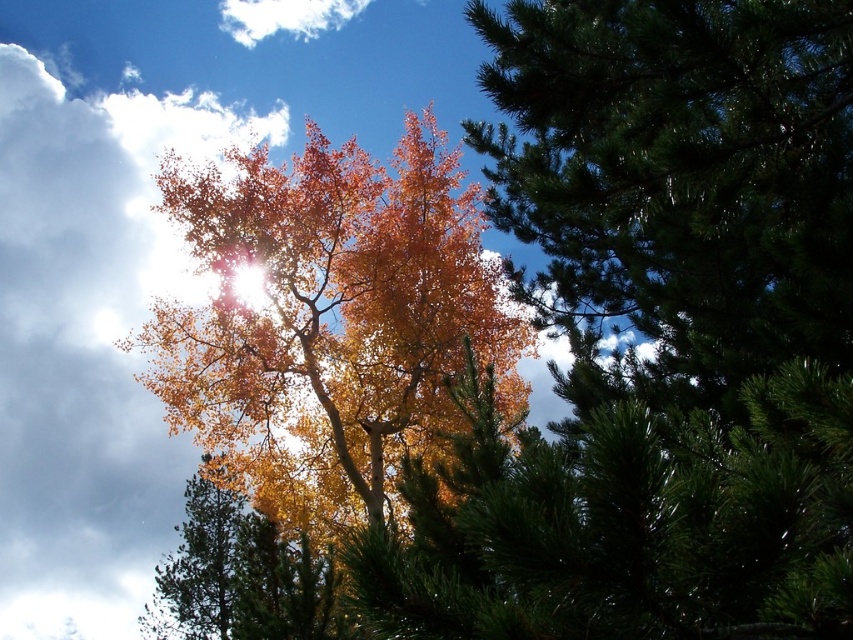
Question: Estimate the real-world distances between objects in this image. Which object is closer to the white fluffy cloud at upper left?

Choices:
 (A) golden leaves at center
 (B) white fluffy cloud at upper center

Answer: (B)

Question: Among these objects, which one is nearest to the camera?

Choices:
 (A) white fluffy cloud at upper center
 (B) white fluffy cloud at upper left
 (C) golden leaves at center

Answer: (B)

Question: Is white fluffy cloud at upper left positioned in front of white fluffy cloud at upper center?

Choices:
 (A) yes
 (B) no

Answer: (A)

Question: Based on their relative distances, which object is farther from the white fluffy cloud at upper center?

Choices:
 (A) golden leaves at center
 (B) white fluffy cloud at upper left

Answer: (A)

Question: Is golden leaves at center bigger than white fluffy cloud at upper center?

Choices:
 (A) yes
 (B) no

Answer: (B)

Question: In this image, where is white fluffy cloud at upper left located relative to white fluffy cloud at upper center?

Choices:
 (A) above
 (B) below

Answer: (B)